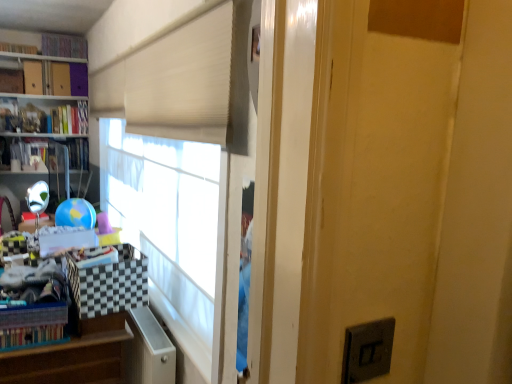
Question: Is multicolored fabric book at upper left, which appears as the 1th book when viewed from the top, wider or thinner than hardcover book at upper left, which is the 2th book from top to bottom?

Choices:
 (A) thin
 (B) wide

Answer: (B)

Question: From the image's perspective, relative to hardcover book at upper left, which is the 2th book from top to bottom, is multicolored fabric book at upper left, which appears as the 1th book when viewed from the top, above or below?

Choices:
 (A) below
 (B) above

Answer: (B)

Question: Considering the real-world distances, which object is closest to the hardcover book at upper left, which is the 2th book from top to bottom?

Choices:
 (A) wooden at left
 (B) hardcover book at left, which is counted as the fourth book, starting from the top
 (C) matte purple bookcase at upper left
 (D) hardcover book at upper left, acting as the second book starting from the bottom
 (E) multicolored fabric book at upper left, which appears as the 1th book when viewed from the top

Answer: (E)

Question: Estimate the real-world distances between objects in this image. Which object is closer to the hardcover book at upper left, acting as the second book starting from the bottom?

Choices:
 (A) white plastic file cabinet at lower left
 (B) hardcover book at left, the 1th book from the bottom
 (C) wooden at left
 (D) multicolored fabric book at upper left, which is the fourth book from bottom to top
 (E) hardcover book at upper left, the third book positioned from the bottom

Answer: (B)